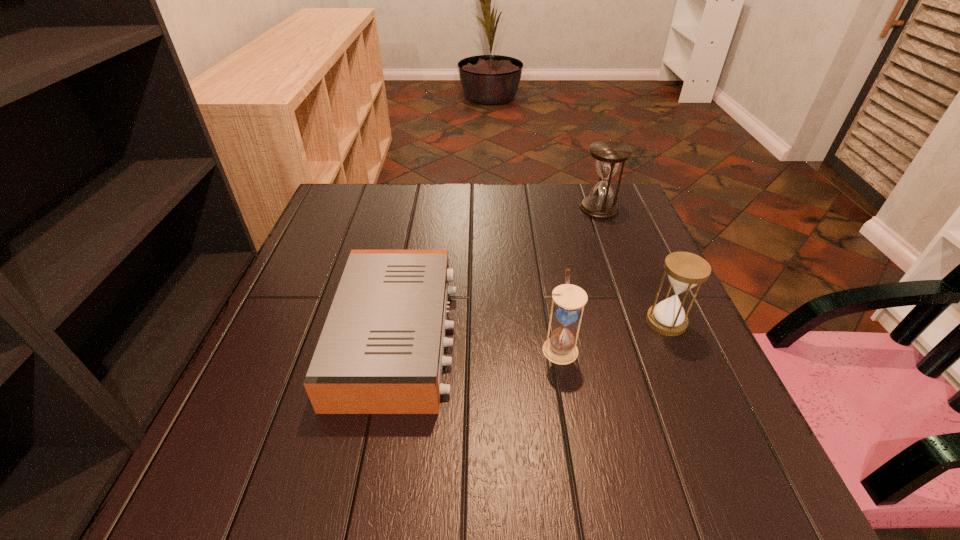
The image size is (960, 540). Find the location of `the farthest hourglass`. the farthest hourglass is located at coordinates (608, 155).

This screenshot has width=960, height=540. I want to click on the third object from right to left, so click(x=560, y=348).

Where is `the leftmost object`? the leftmost object is located at coordinates (381, 351).

Locate an element on the screen. radio receiver is located at coordinates (381, 351).

Locate an element on the screen. This screenshot has height=540, width=960. vacant space positioned on the left of the farthest object is located at coordinates (531, 208).

This screenshot has height=540, width=960. What are the coordinates of `free space located 0.240m on the right of the third object from right to left` in the screenshot? It's located at (698, 348).

You are a GUI agent. You are given a task and a screenshot of the screen. Output one action in this format:
    pyautogui.click(x=<x>, y=<y>)
    Task: Click on the free point located on the control panel of the radio receiver
    Image resolution: width=960 pixels, height=540 pixels.
    Given the screenshot: What is the action you would take?
    pyautogui.click(x=566, y=336)

This screenshot has height=540, width=960. Identify the location of object present at the far edge. (608, 155).

Find the location of `object that is at the left edge`. object that is at the left edge is located at coordinates (381, 351).

Find the location of a particular element. The height and width of the screenshot is (540, 960). object that is at the far right corner is located at coordinates (608, 155).